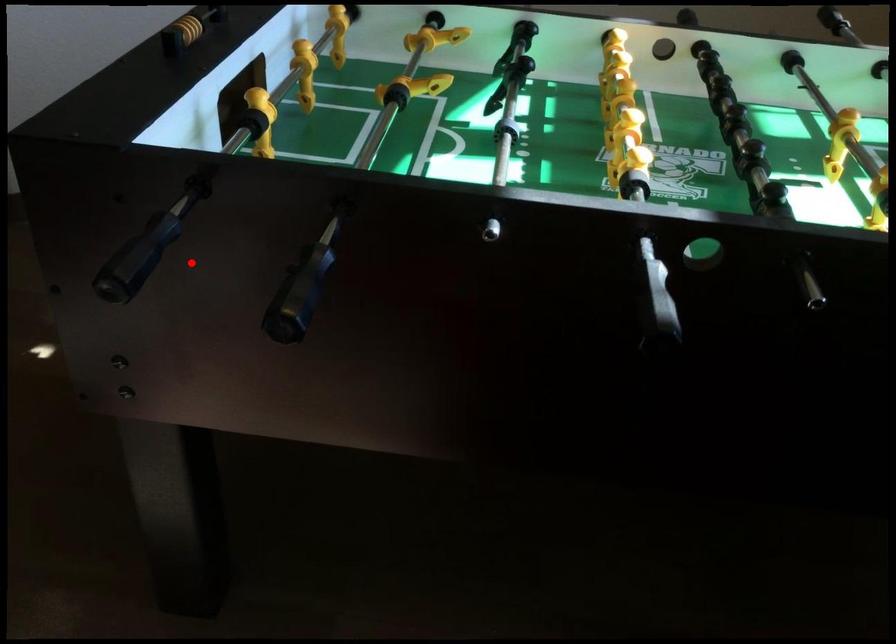
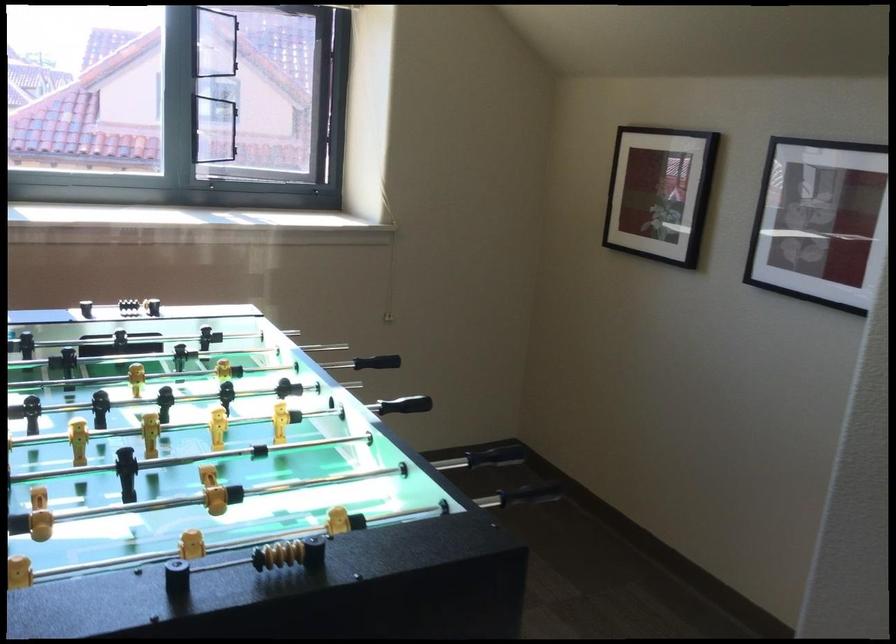
Question: I am providing you with two images of the same scene from different viewpoints. A red point is shown in image1. For the corresponding object point in image2, is it positioned nearer or farther from the camera?

Choices:
 (A) Nearer
 (B) Farther

Answer: (B)